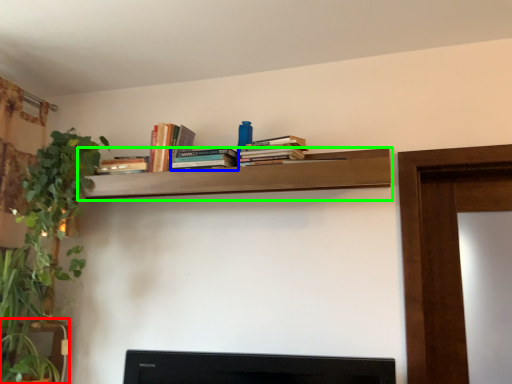
Question: Considering the real-world distances, which object is farthest from furniture (highlighted by a red box)? book (highlighted by a blue box) or shelf (highlighted by a green box)?

Choices:
 (A) book
 (B) shelf

Answer: (A)